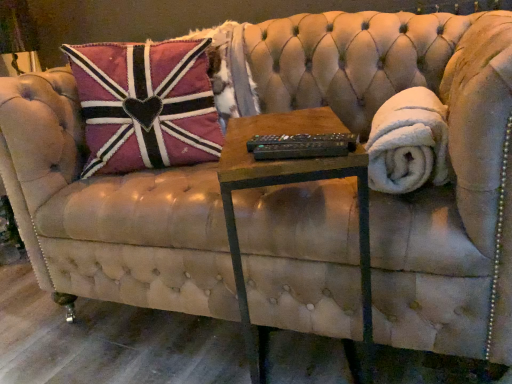
Question: Is white fluffy blanket at right taller or shorter than woodenmaterial/texturetable at center?

Choices:
 (A) short
 (B) tall

Answer: (A)

Question: In the image, is white fluffy blanket at right positioned in front of or behind woodenmaterial/texturetable at center?

Choices:
 (A) behind
 (B) front

Answer: (A)

Question: In the image, is white fluffy blanket at right on the left side or the right side of woodenmaterial/texturetable at center?

Choices:
 (A) left
 (B) right

Answer: (B)

Question: From the image's perspective, is woodenmaterial/texturetable at center located above or below white fluffy blanket at right?

Choices:
 (A) above
 (B) below

Answer: (B)

Question: Is woodenmaterial/texturetable at center spatially inside white fluffy blanket at right, or outside of it?

Choices:
 (A) inside
 (B) outside

Answer: (B)

Question: In the image, is woodenmaterial/texturetable at center on the left side or the right side of white fluffy blanket at right?

Choices:
 (A) left
 (B) right

Answer: (A)

Question: In terms of width, does woodenmaterial/texturetable at center look wider or thinner when compared to white fluffy blanket at right?

Choices:
 (A) thin
 (B) wide

Answer: (B)